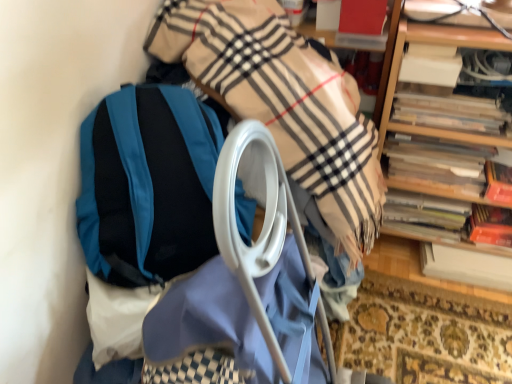
Question: Is wooden bookshelf at upper right at the back of white paper at right, which is counted as the 1th book, starting from the bottom?

Choices:
 (A) no
 (B) yes

Answer: (B)

Question: From a real-world perspective, does white paper at right, which is counted as the 5th book, starting from the top, stand above wooden bookshelf at upper right?

Choices:
 (A) no
 (B) yes

Answer: (A)

Question: Is white paper at right, which is counted as the 1th book, starting from the bottom, next to wooden bookshelf at upper right and touching it?

Choices:
 (A) yes
 (B) no

Answer: (B)

Question: Considering the relative sizes of white paper at right, which is counted as the 5th book, starting from the top, and wooden bookshelf at upper right in the image provided, is white paper at right, which is counted as the 5th book, starting from the top, shorter than wooden bookshelf at upper right?

Choices:
 (A) yes
 (B) no

Answer: (A)

Question: Is white paper at right, which is counted as the 1th book, starting from the bottom, oriented towards wooden bookshelf at upper right?

Choices:
 (A) yes
 (B) no

Answer: (A)

Question: From their relative heights in the image, would you say white paper at right, which is counted as the 1th book, starting from the bottom, is taller or shorter than hardcover book at right, which is the 4th book from top to bottom?

Choices:
 (A) tall
 (B) short

Answer: (B)

Question: Is white paper at right, which is counted as the 1th book, starting from the bottom, wider or thinner than hardcover book at right, which is the 4th book from top to bottom?

Choices:
 (A) thin
 (B) wide

Answer: (B)

Question: In the image, is white paper at right, which is counted as the 5th book, starting from the top, positioned in front of or behind hardcover book at right, the second book positioned from the bottom?

Choices:
 (A) behind
 (B) front

Answer: (B)

Question: Which is correct: white paper at right, which is counted as the 5th book, starting from the top, is inside hardcover book at right, which is the 4th book from top to bottom, or outside of it?

Choices:
 (A) inside
 (B) outside

Answer: (B)

Question: Is wooden spines at right, the second book from the top, spatially inside white paper at right, which is counted as the 5th book, starting from the top, or outside of it?

Choices:
 (A) outside
 (B) inside

Answer: (A)

Question: Based on their sizes in the image, would you say wooden spines at right, which ranks as the fourth book in bottom-to-top order, is bigger or smaller than white paper at right, which is counted as the 1th book, starting from the bottom?

Choices:
 (A) big
 (B) small

Answer: (B)

Question: In the image, is wooden spines at right, the second book from the top, positioned in front of or behind white paper at right, which is counted as the 5th book, starting from the top?

Choices:
 (A) front
 (B) behind

Answer: (A)

Question: Considering the positions of point (459, 97) and point (463, 266), is point (459, 97) closer or farther from the camera than point (463, 266)?

Choices:
 (A) farther
 (B) closer

Answer: (B)

Question: Relative to wooden book at right, the third book in the bottom-to-top sequence, is teal fabric backpack at left in front or behind?

Choices:
 (A) behind
 (B) front

Answer: (B)

Question: From the image's perspective, relative to wooden book at right, the third book in the bottom-to-top sequence, is teal fabric backpack at left above or below?

Choices:
 (A) below
 (B) above

Answer: (A)